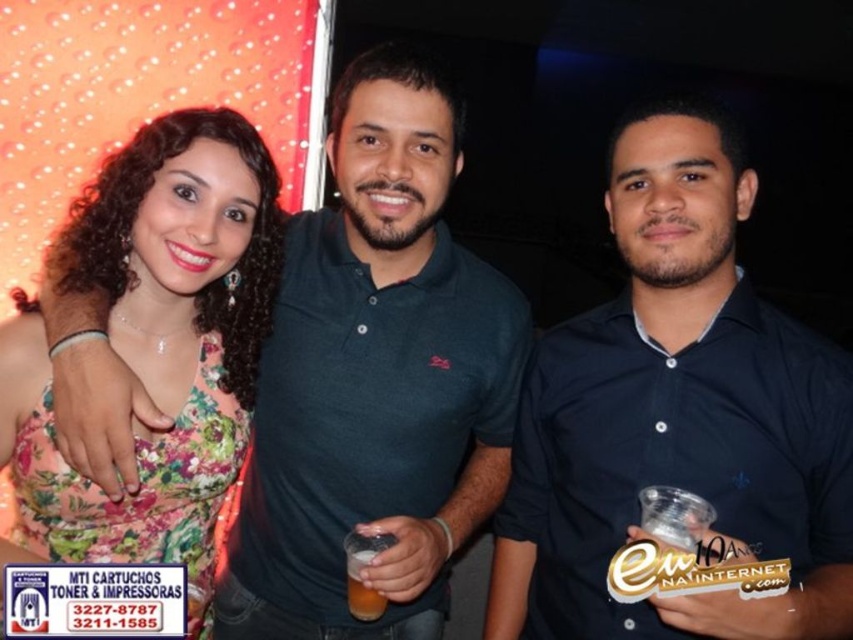
You are taking a photo of two points in the scene. The first point is at coordinate point (x=651, y=385) and the second is at point (x=357, y=353). Which point is closer to the camera?

Point (x=651, y=385) is closer to the camera than point (x=357, y=353).